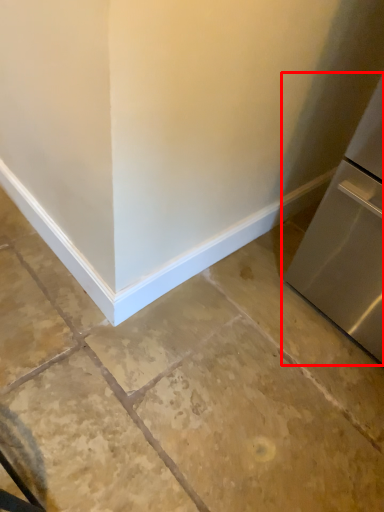
Question: Observing the image, what is the correct spatial positioning of refrigerator (annotated by the red box) in reference to concrete?

Choices:
 (A) right
 (B) left

Answer: (A)